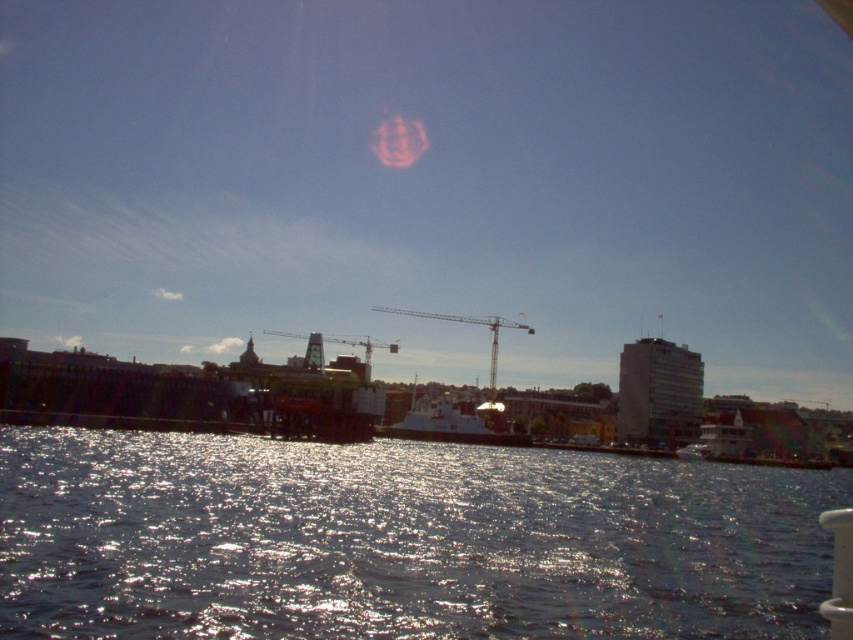
Question: Which of the following is the farthest from the observer?

Choices:
 (A) glistening water at center
 (B) metallic construction crane at center

Answer: (B)

Question: Considering the relative positions of glistening water at center and metallic construction crane at center in the image provided, where is glistening water at center located with respect to metallic construction crane at center?

Choices:
 (A) left
 (B) right

Answer: (B)

Question: Which of these objects is positioned farthest from the metallic construction crane at center?

Choices:
 (A) glistening water at center
 (B) white matte boat at center

Answer: (A)

Question: Does glistening water at center appear on the left side of metallic construction crane at center?

Choices:
 (A) yes
 (B) no

Answer: (B)

Question: Is white matte boat at center wider than green metallic crane at center?

Choices:
 (A) yes
 (B) no

Answer: (B)

Question: Which point appears farthest from the camera in this image?

Choices:
 (A) (303, 522)
 (B) (463, 321)

Answer: (B)